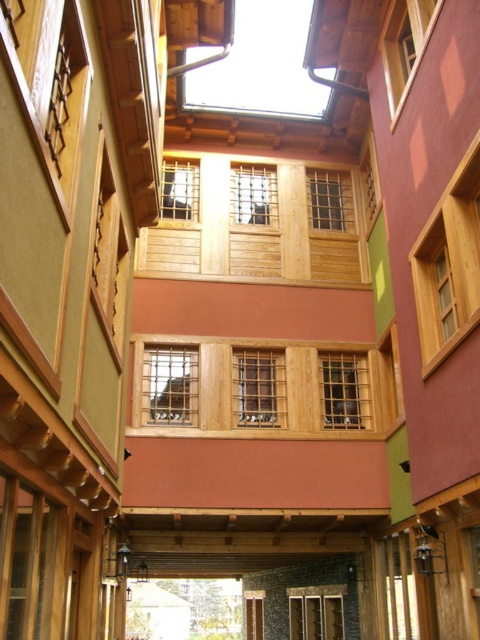
Question: Can you confirm if wooden balcony at center is smaller than natural wood balcony at center?

Choices:
 (A) no
 (B) yes

Answer: (A)

Question: Which of the following is the closest to the observer?

Choices:
 (A) (319, 236)
 (B) (381, 424)

Answer: (B)

Question: Does wooden balcony at center appear on the left side of natural wood balcony at center?

Choices:
 (A) yes
 (B) no

Answer: (B)

Question: Is wooden balcony at center positioned behind natural wood balcony at center?

Choices:
 (A) yes
 (B) no

Answer: (B)